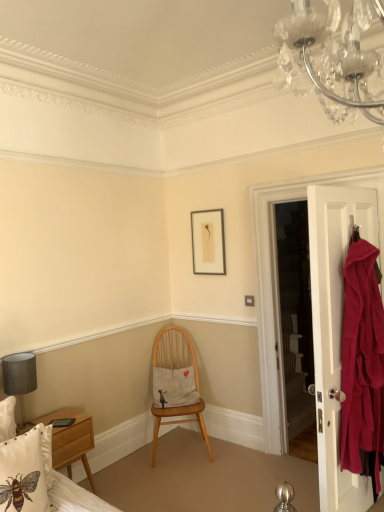
Question: From their relative heights in the image, would you say white cotton pillow with bee design at lower left, which appears as the 2th pillow when viewed from the right, is taller or shorter than matte black picture frame at upper center?

Choices:
 (A) short
 (B) tall

Answer: (A)

Question: Is white cotton pillow with bee design at lower left, which is counted as the second pillow, starting from the back, inside or outside of matte black picture frame at upper center?

Choices:
 (A) outside
 (B) inside

Answer: (A)

Question: Based on their relative distances, which object is nearer to the matte black picture frame at upper center?

Choices:
 (A) matte gray lampshade at left
 (B) matte white door at right
 (C) white cotton cushion at center, arranged as the 2th pillow when viewed from the left
 (D) white cotton pillow with bee design at lower left, which is counted as the second pillow, starting from the back
 (E) wooden chair at center

Answer: (E)

Question: Based on their relative distances, which object is farther from the matte black picture frame at upper center?

Choices:
 (A) white cotton pillow with bee design at lower left, which appears as the 2th pillow when viewed from the right
 (B) matte white door at right
 (C) wooden chair at center
 (D) white cotton bed at lower left
 (E) matte gray lampshade at left

Answer: (A)